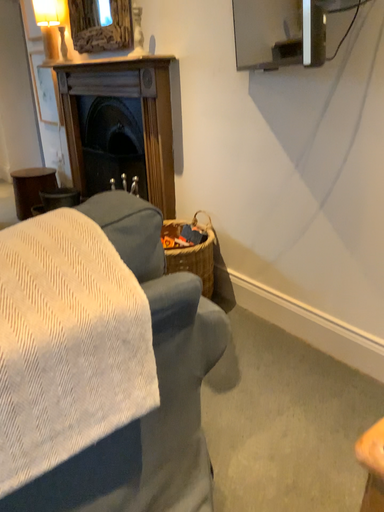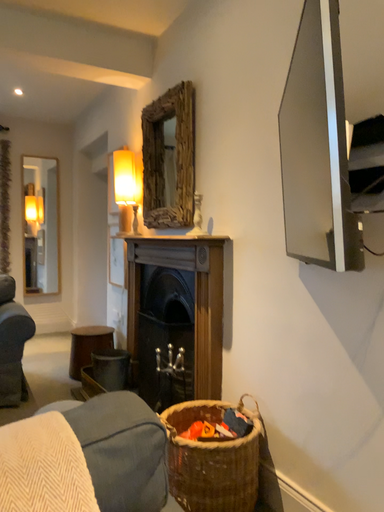
Question: How did the camera likely rotate when shooting the video?

Choices:
 (A) rotated right
 (B) rotated left

Answer: (B)